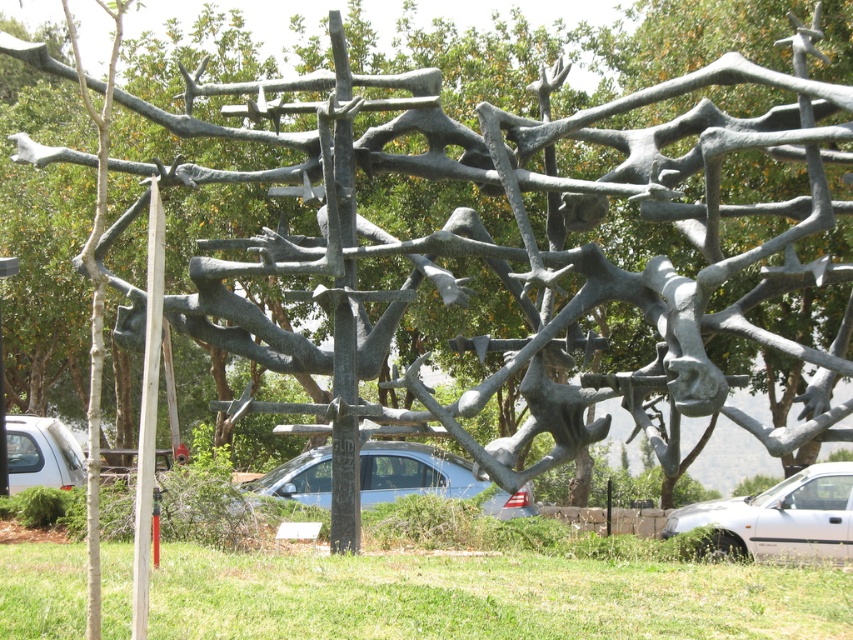
Which of these two, satin silver car at center or white matte car at lower left, stands taller?

satin silver car at center is taller.

Measure the distance between point (415, 461) and camera.

The distance of point (415, 461) from camera is 28.13 meters.

Find the location of a particular element. The width and height of the screenshot is (853, 640). satin silver car at center is located at coordinates (430, 477).

Does point (334, 524) come in front of point (780, 520)?

Yes, it is in front of point (780, 520).

Consider the image. Can you confirm if bronze textured pole at center is shorter than silver metallic car at lower right?

In fact, bronze textured pole at center may be taller than silver metallic car at lower right.

Is point (334, 436) positioned behind point (679, 531)?

No, it is not.

Locate an element on the screen. This screenshot has height=640, width=853. bronze textured pole at center is located at coordinates (343, 413).

Can you confirm if satin silver car at center is positioned above wooden pole at left?

No.

Locate an element on the screen. satin silver car at center is located at coordinates (430, 477).

This screenshot has height=640, width=853. What do you see at coordinates (430, 477) in the screenshot?
I see `satin silver car at center` at bounding box center [430, 477].

At what (x,y) coordinates should I click in order to perform the action: click on satin silver car at center. Please return your answer as a coordinate pair (x, y). Looking at the image, I should click on (430, 477).